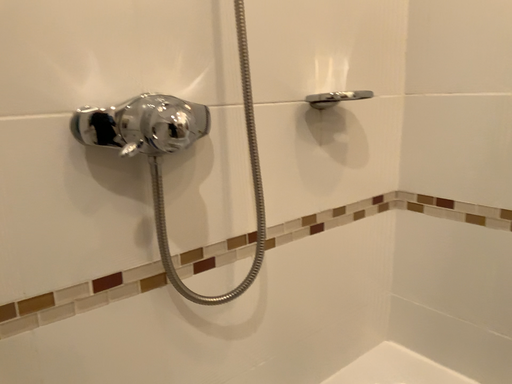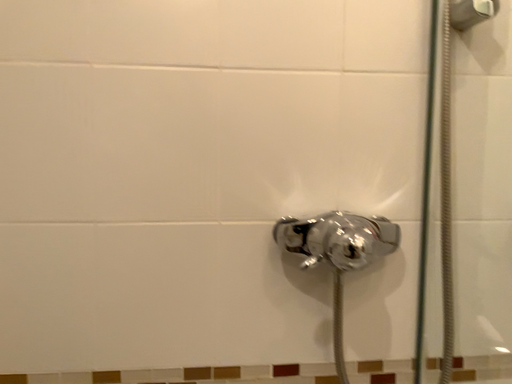
Question: How did the camera likely rotate when shooting the video?

Choices:
 (A) rotated right
 (B) rotated left

Answer: (B)